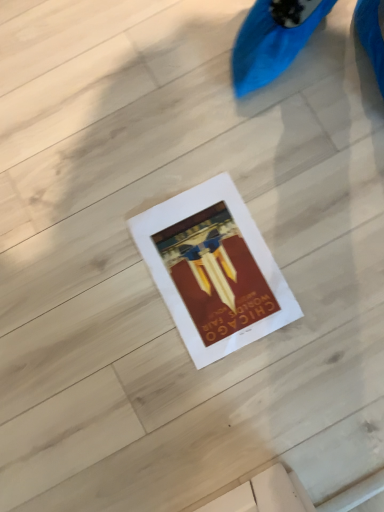
I want to click on free space above matte paper poster at center (from a real-world perspective), so click(218, 270).